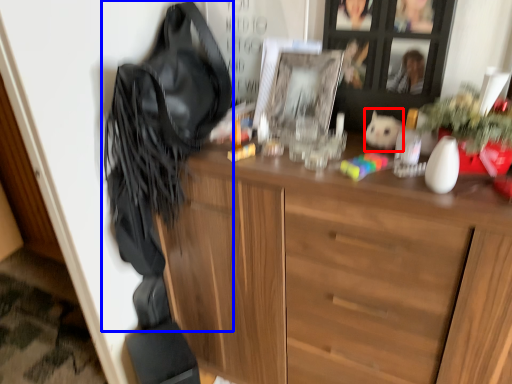
Question: Which object appears farthest to the camera in this image, animal (highlighted by a red box) or shoulder bag (highlighted by a blue box)?

Choices:
 (A) animal
 (B) shoulder bag

Answer: (A)